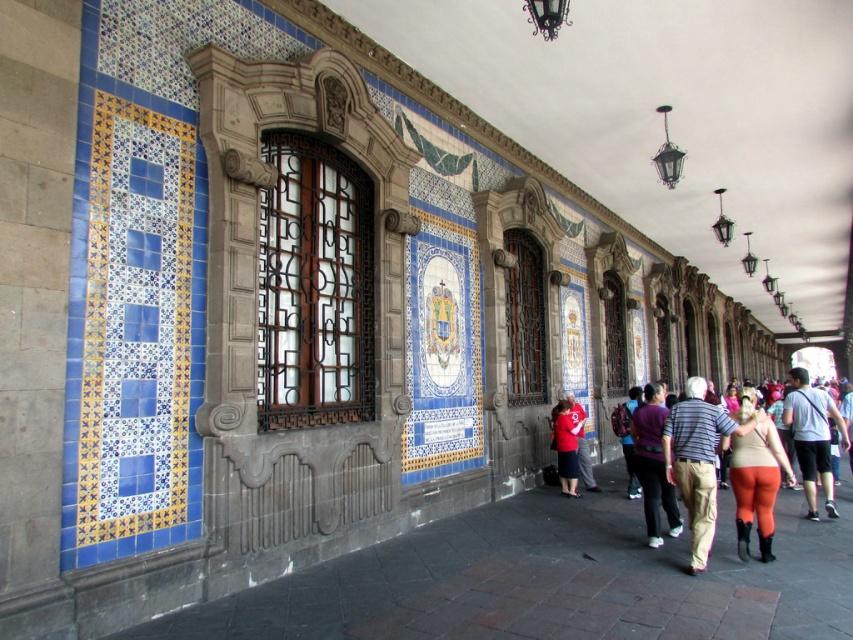
Is point (697, 556) positioned before point (570, 433)?

Yes, it is in front of point (570, 433).

You are a GUI agent. You are given a task and a screenshot of the screen. Output one action in this format:
    pyautogui.click(x=<x>, y=<y>)
    Task: Click on the matte beige pants at center
    
    Given the screenshot: What is the action you would take?
    pyautogui.click(x=695, y=461)

Looking at this image, is white cotton shirt at right further to camera compared to purple fabric at center?

That is True.

What do you see at coordinates (811, 436) in the screenshot?
I see `white cotton shirt at right` at bounding box center [811, 436].

Where is `white cotton shirt at right`? Image resolution: width=853 pixels, height=640 pixels. white cotton shirt at right is located at coordinates (811, 436).

Which is in front, point (328, 337) or point (699, 416)?

Positioned in front is point (699, 416).

Can you confirm if brown wooden window at center is wider than matte beige pants at center?

Yes.

Which is behind, point (271, 384) or point (717, 417)?

The point (717, 417) is behind.

Where is `brown wooden window at center`? The width and height of the screenshot is (853, 640). brown wooden window at center is located at coordinates (314, 285).